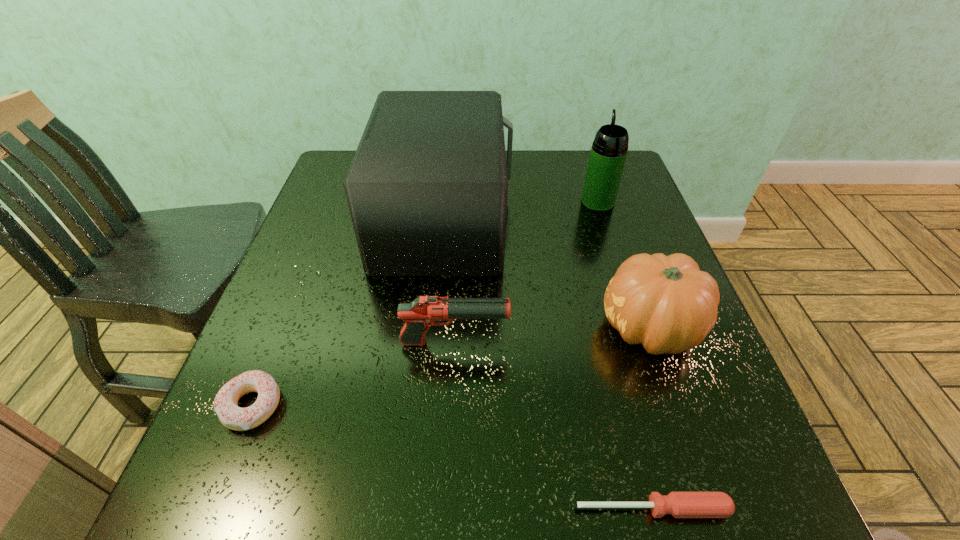
Find the location of a particular element. This screenshot has height=540, width=960. object that can be found as the third closest to the pumpkin is located at coordinates (679, 504).

Where is `the closest object relative to the thermos bottle`? This screenshot has width=960, height=540. the closest object relative to the thermos bottle is located at coordinates (427, 189).

In order to click on blank space that satisfies the following two spatial constraints: 1. on the front-facing side of the shortest object; 2. on the left side of the microwave oven in this screenshot , I will do point(416,509).

The image size is (960, 540). Identify the location of vacant area that satisfies the following two spatial constraints: 1. on the front side of the screwdriver; 2. on the left side of the doughnut. (211, 509).

Find the location of a particular element. vacant region that satisfies the following two spatial constraints: 1. at the aiming end of the shortest object; 2. on the left side of the gun is located at coordinates (445, 509).